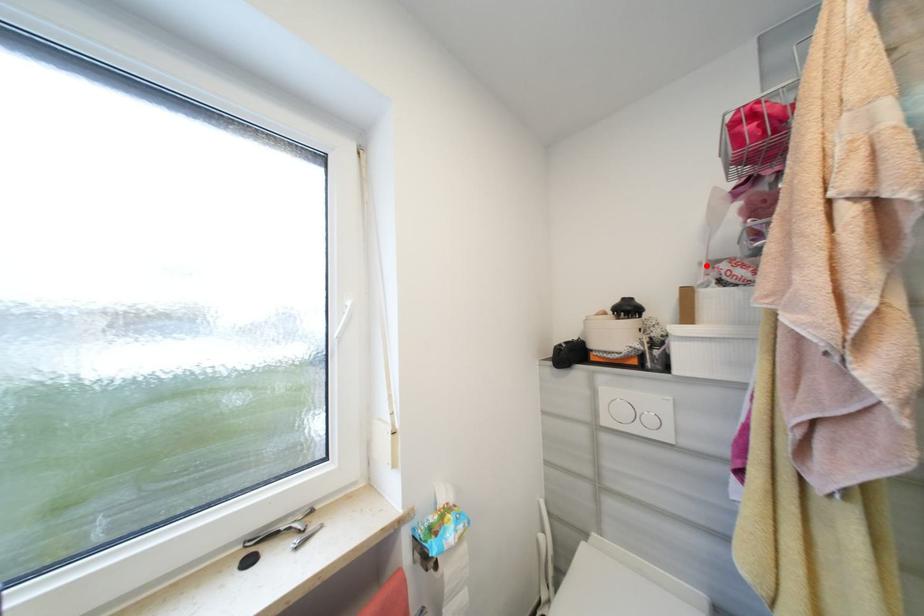
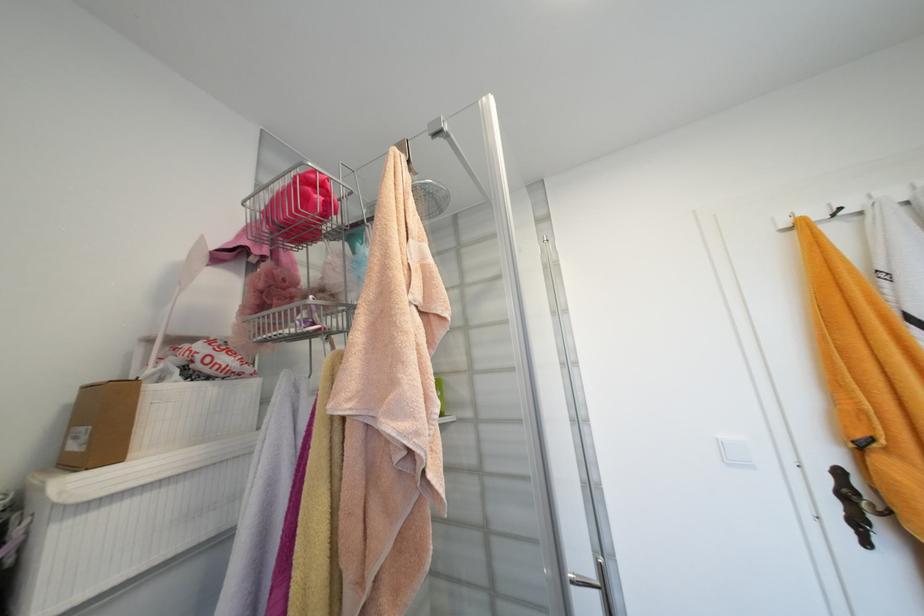
In the second image, find the point that corresponds to the highlighted location in the first image.

(154, 342)